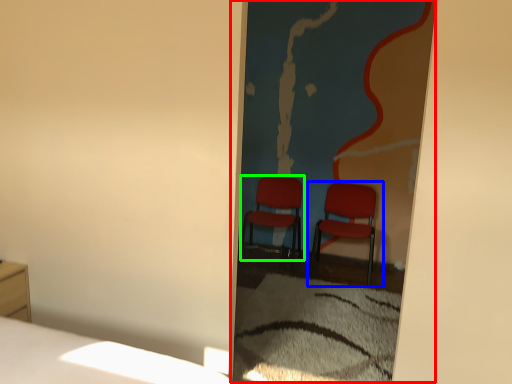
Question: Estimate the real-world distances between objects in this image. Which object is farther from screen door (highlighted by a red box), chair (highlighted by a blue box) or chair (highlighted by a green box)?

Choices:
 (A) chair
 (B) chair

Answer: (B)